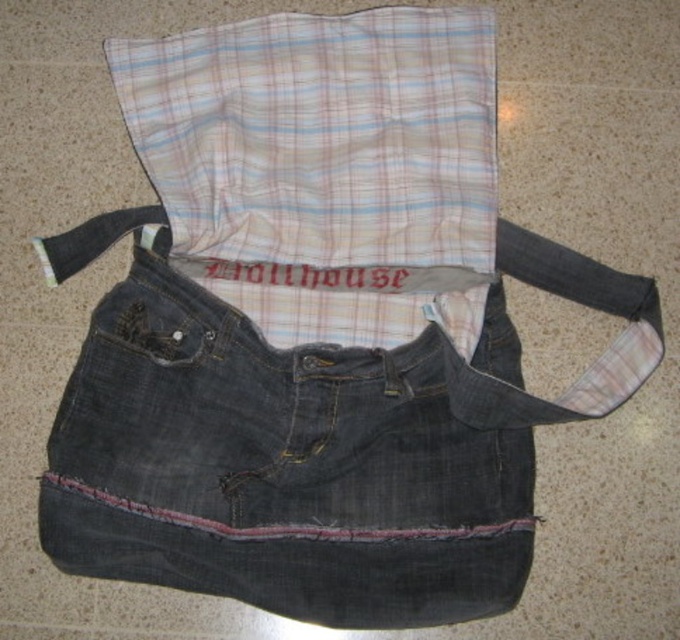
You are standing in front of the repurposed bag and want to place a small button exactly halfway between point A at point [486,324] and point B at point [459,328]. Which point is closer to the front of the bag?

Point B at point [459,328] is closer to the front of the bag because it is in front of point A at point [486,324].

You are a photographer standing 1.5 meters away from the denim at center. You want to take a closeup shot of the bag. Is the current distance sufficient to capture the entire bag in the frame?

The denim at center is 1.11 meters away from the camera. Since you are standing 1.5 meters away, the distance is sufficient to capture the entire bag in the frame.

You are a tailor trying to locate a specific point on the bag. The point is at coordinates (324,168). Based on the scene description, where on the bag would this point most likely be located?

The point at coordinates (324,168) is on the plaid fabric at center, which is part of the top portion of the bag lined with a plaid shirt featuring horizontal stripes in shades of pink, blue, and white.